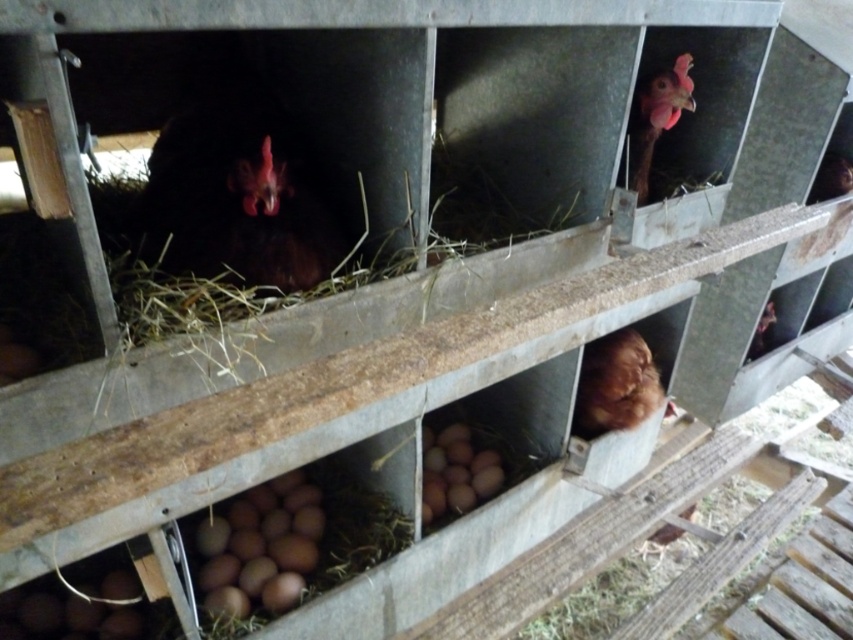
Question: Is black matte chicken at center above brown matte eggs at center?

Choices:
 (A) no
 (B) yes

Answer: (B)

Question: Which object is farther from the camera taking this photo?

Choices:
 (A) brown matte eggs at center
 (B) pink matte chicken at upper right
 (C) black matte chicken at center

Answer: (B)

Question: Is brown matte eggs at center behind brown fluffy chicken at lower center?

Choices:
 (A) no
 (B) yes

Answer: (A)

Question: Estimate the real-world distances between objects in this image. Which object is farther from the pink matte chicken at upper right?

Choices:
 (A) black matte chicken at center
 (B) brown fluffy chicken at lower center
 (C) brown matte eggs at center

Answer: (C)

Question: Is the position of brown matte eggs at center less distant than that of pink matte chicken at upper right?

Choices:
 (A) yes
 (B) no

Answer: (A)

Question: Which point is farther to the camera?

Choices:
 (A) brown matte eggs at center
 (B) brown fluffy chicken at lower center
 (C) pink matte chicken at upper right
 (D) black matte chicken at center

Answer: (B)